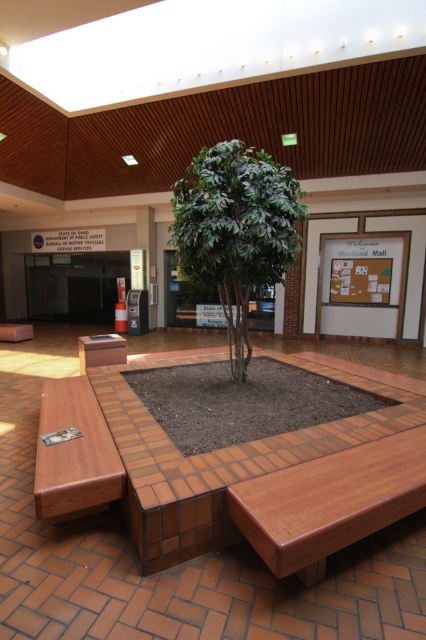
You are standing in the atrium and want to sit down. You see the green leafy tree at center and the brown wood bench at lower left. Which object is closer to you, and can you sit on it?

The green leafy tree at center is closer to the viewer than the brown wood bench at lower left. However, you cannot sit on the tree since it is a plant, so the closest object you can sit on is the brown wood bench at lower left.

Looking at this image, you are a person who wants to sit on the benches in the atrium. You see the wooden bench at lower left and the brown wood bench at lower left. Which bench is wider?

The wooden bench at lower left is wider than the brown wood bench at lower left.

You are a maintenance worker who needs to move a 5 feet long ladder from the wooden bench at lower left to the wooden bench at center. Is there enough space between the two benches to move the ladder without tilting it?

The distance between the wooden bench at center and the wooden bench at lower left is 4.54 feet, which is shorter than the ladder length of 5 feet. Therefore, the ladder cannot be moved straight between them without tilting.